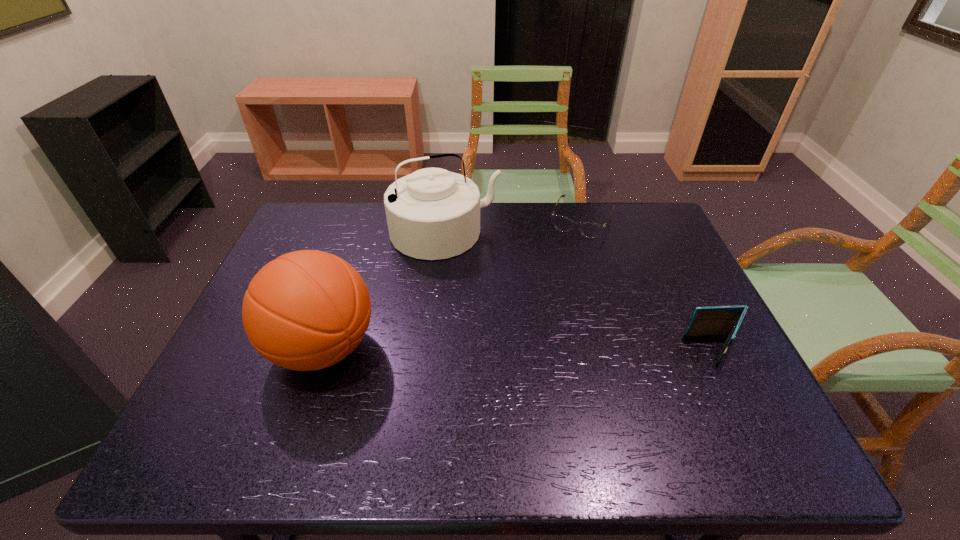
At what (x,y) coordinates should I click in order to perform the action: click on vacant region located 0.370m on the front-facing side of the shortest object. Please return your answer as a coordinate pair (x, y). The width and height of the screenshot is (960, 540). Looking at the image, I should click on (536, 321).

Find the location of a particular element. vacant space positioned on the front-facing side of the shortest object is located at coordinates (564, 258).

Where is `blank space located 0.220m on the front-facing side of the shortest object`? blank space located 0.220m on the front-facing side of the shortest object is located at coordinates (553, 284).

Image resolution: width=960 pixels, height=540 pixels. What are the coordinates of `free point located 0.390m on the spout of the kettle` in the screenshot? It's located at (508, 363).

This screenshot has width=960, height=540. What are the coordinates of `vacant point located on the spout of the kettle` in the screenshot? It's located at (482, 307).

Identify the location of free space located 0.230m on the spout of the kettle. (486, 314).

The image size is (960, 540). Find the location of `spectacles located in the far edge section of the desktop`. spectacles located in the far edge section of the desktop is located at coordinates (591, 230).

The image size is (960, 540). I want to click on kettle located at the far edge, so click(432, 214).

Locate an element on the screen. The width and height of the screenshot is (960, 540). object that is at the near edge is located at coordinates (306, 310).

At what (x,y) coordinates should I click in order to perform the action: click on object that is at the left edge. Please return your answer as a coordinate pair (x, y). This screenshot has height=540, width=960. Looking at the image, I should click on (306, 310).